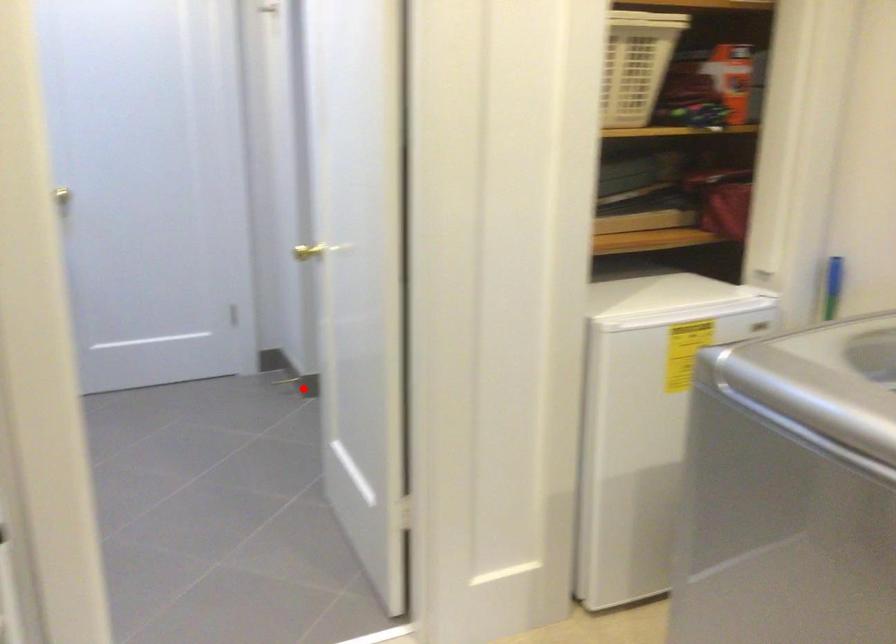
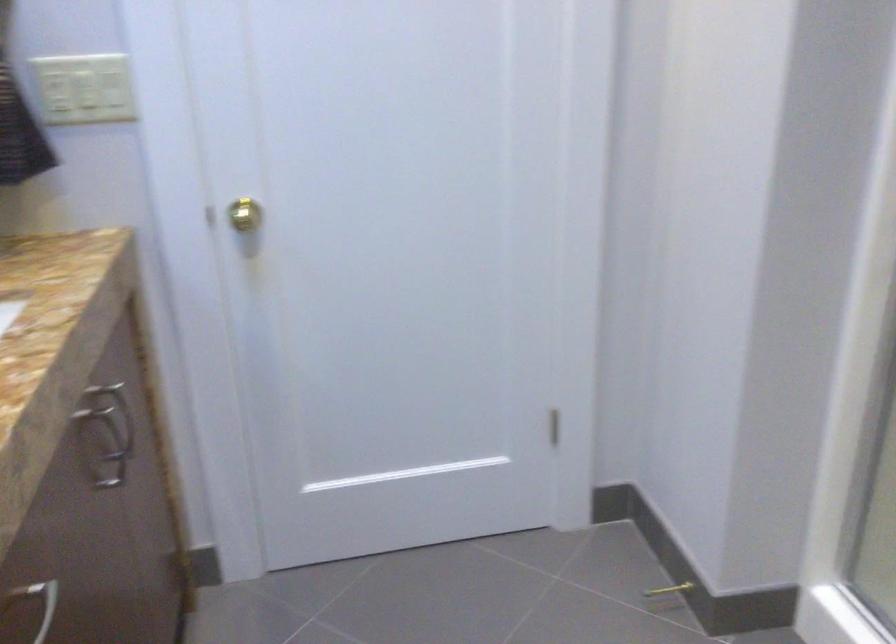
Question: A red point is marked in image1. In image2, is the corresponding 3D point closer to the camera or farther? Reply with the corresponding letter.

Choices:
 (A) The corresponding 3D point is closer.
 (B) The corresponding 3D point is farther.

Answer: (A)